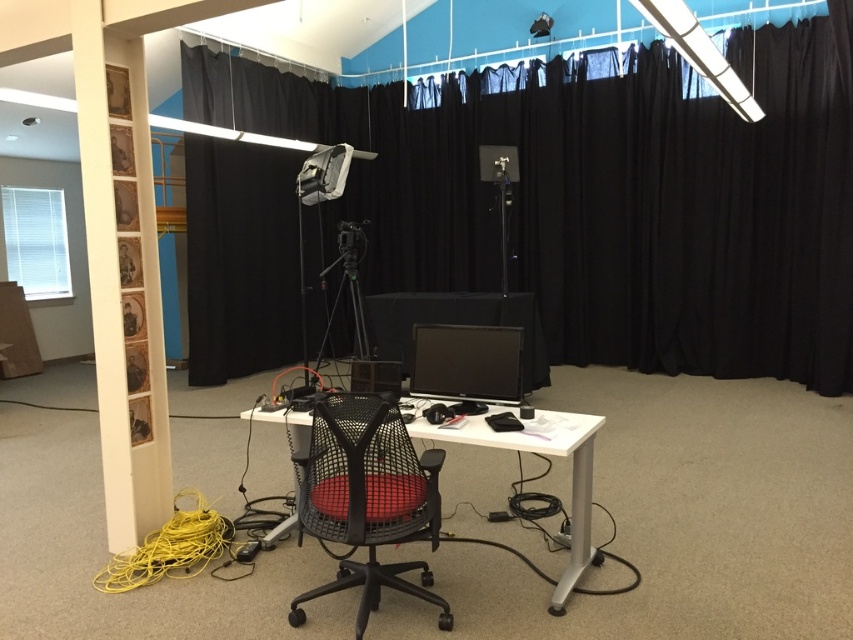
Question: Can you confirm if black fabric curtain at center is wider than white plastic computer desk at center?

Choices:
 (A) no
 (B) yes

Answer: (A)

Question: Which point is closer to the camera?

Choices:
 (A) black fabric curtain at center
 (B) matte black monitor at center

Answer: (B)

Question: Which of these objects is positioned farthest from the mesh black swivel chair at center?

Choices:
 (A) white plastic computer desk at center
 (B) matte black monitor at center
 (C) black fabric curtain at center

Answer: (C)

Question: Can you confirm if mesh black swivel chair at center is wider than white plastic computer desk at center?

Choices:
 (A) yes
 (B) no

Answer: (B)

Question: Does black fabric curtain at center have a larger size compared to white plastic computer desk at center?

Choices:
 (A) no
 (B) yes

Answer: (A)

Question: Estimate the real-world distances between objects in this image. Which object is closer to the mesh black swivel chair at center?

Choices:
 (A) black fabric curtain at center
 (B) white plastic computer desk at center

Answer: (B)